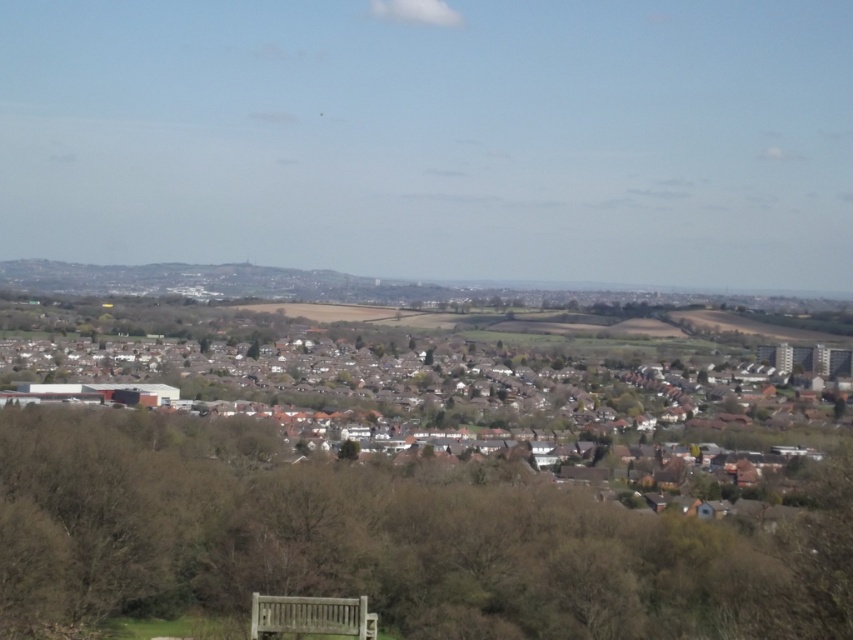
Question: Observing the image, what is the correct spatial positioning of brown textured bench at lower center in reference to wooden bench at lower center?

Choices:
 (A) right
 (B) left

Answer: (A)

Question: Among these points, which one is nearest to the camera?

Choices:
 (A) (527, 368)
 (B) (544, 570)
 (C) (343, 632)

Answer: (C)

Question: Which point is closer to the camera?

Choices:
 (A) (325, 624)
 (B) (422, 372)
 (C) (566, 616)

Answer: (A)

Question: Which point is farther from the camera taking this photo?

Choices:
 (A) (299, 621)
 (B) (439, 396)

Answer: (B)

Question: In this image, where is white matte houses at center located relative to wooden bench at lower center?

Choices:
 (A) below
 (B) above

Answer: (B)

Question: Does brown textured bench at lower center have a greater width compared to white matte houses at center?

Choices:
 (A) no
 (B) yes

Answer: (A)